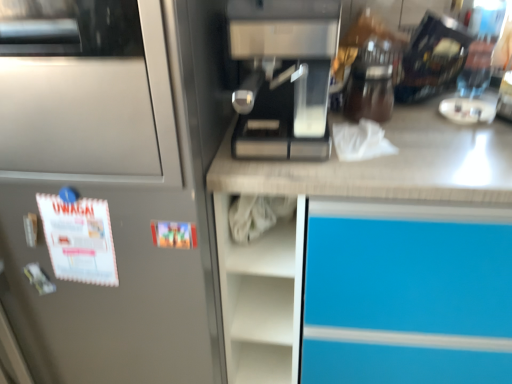
Question: Considering the relative positions of satin silver refrigerator at left and black glossy coffee maker at upper right in the image provided, is satin silver refrigerator at left to the right of black glossy coffee maker at upper right from the viewer's perspective?

Choices:
 (A) no
 (B) yes

Answer: (A)

Question: Considering the relative sizes of satin silver refrigerator at left and black glossy coffee maker at upper right in the image provided, is satin silver refrigerator at left shorter than black glossy coffee maker at upper right?

Choices:
 (A) yes
 (B) no

Answer: (B)

Question: Is satin silver refrigerator at left positioned with its back to black glossy coffee maker at upper right?

Choices:
 (A) yes
 (B) no

Answer: (B)

Question: Considering the relative sizes of satin silver refrigerator at left and black glossy coffee maker at upper right in the image provided, is satin silver refrigerator at left taller than black glossy coffee maker at upper right?

Choices:
 (A) yes
 (B) no

Answer: (A)

Question: From a real-world perspective, is satin silver refrigerator at left physically below black glossy coffee maker at upper right?

Choices:
 (A) no
 (B) yes

Answer: (B)

Question: Is satin silver refrigerator at left with black glossy coffee maker at upper right?

Choices:
 (A) no
 (B) yes

Answer: (A)

Question: Is sleek metallic coffee machine at center to the left of black glossy coffee maker at upper right from the viewer's perspective?

Choices:
 (A) no
 (B) yes

Answer: (B)

Question: From the image's perspective, is sleek metallic coffee machine at center located beneath black glossy coffee maker at upper right?

Choices:
 (A) no
 (B) yes

Answer: (B)

Question: Could you tell me if sleek metallic coffee machine at center is turned towards black glossy coffee maker at upper right?

Choices:
 (A) no
 (B) yes

Answer: (A)

Question: Is sleek metallic coffee machine at center shorter than black glossy coffee maker at upper right?

Choices:
 (A) yes
 (B) no

Answer: (B)

Question: Is sleek metallic coffee machine at center far away from black glossy coffee maker at upper right?

Choices:
 (A) yes
 (B) no

Answer: (B)

Question: Is sleek metallic coffee machine at center wider than black glossy coffee maker at upper right?

Choices:
 (A) no
 (B) yes

Answer: (B)

Question: Can you confirm if sleek metallic coffee machine at center is wider than satin silver refrigerator at left?

Choices:
 (A) yes
 (B) no

Answer: (B)